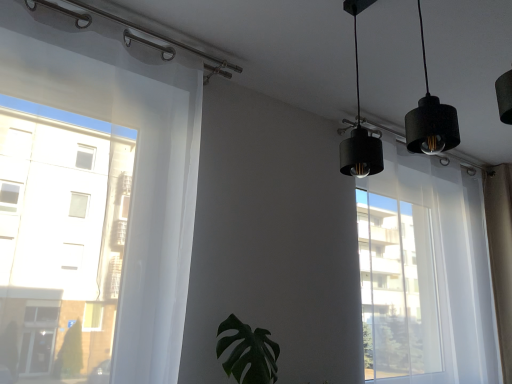
Question: Could green matte leaf at center be considered to be inside black matte lampshade at upper right?

Choices:
 (A) yes
 (B) no

Answer: (B)

Question: Considering the relative sizes of black matte lampshade at upper right and green matte leaf at center in the image provided, is black matte lampshade at upper right shorter than green matte leaf at center?

Choices:
 (A) no
 (B) yes

Answer: (A)

Question: Is black matte lampshade at upper right taller than green matte leaf at center?

Choices:
 (A) no
 (B) yes

Answer: (B)

Question: From a real-world perspective, is black matte lampshade at upper right physically above green matte leaf at center?

Choices:
 (A) no
 (B) yes

Answer: (B)

Question: Is black matte lampshade at upper right aimed at green matte leaf at center?

Choices:
 (A) no
 (B) yes

Answer: (A)

Question: From the image's perspective, is black matte lampshade at upper right over green matte leaf at center?

Choices:
 (A) yes
 (B) no

Answer: (A)

Question: Does green matte leaf at center have a lesser width compared to black matte lampshade at upper right?

Choices:
 (A) yes
 (B) no

Answer: (B)

Question: Is green matte leaf at center not inside black matte lampshade at upper right?

Choices:
 (A) yes
 (B) no

Answer: (A)

Question: Is green matte leaf at center to the right of black matte lampshade at upper right from the viewer's perspective?

Choices:
 (A) no
 (B) yes

Answer: (A)

Question: Is green matte leaf at center not near black matte lampshade at upper right?

Choices:
 (A) no
 (B) yes

Answer: (B)

Question: From the image's perspective, would you say green matte leaf at center is shown under black matte lampshade at upper right?

Choices:
 (A) no
 (B) yes

Answer: (B)

Question: From a real-world perspective, is green matte leaf at center on top of black matte lampshade at upper right?

Choices:
 (A) no
 (B) yes

Answer: (A)

Question: From the image's perspective, relative to green matte leaf at center, is black matte lampshade at upper right above or below?

Choices:
 (A) above
 (B) below

Answer: (A)